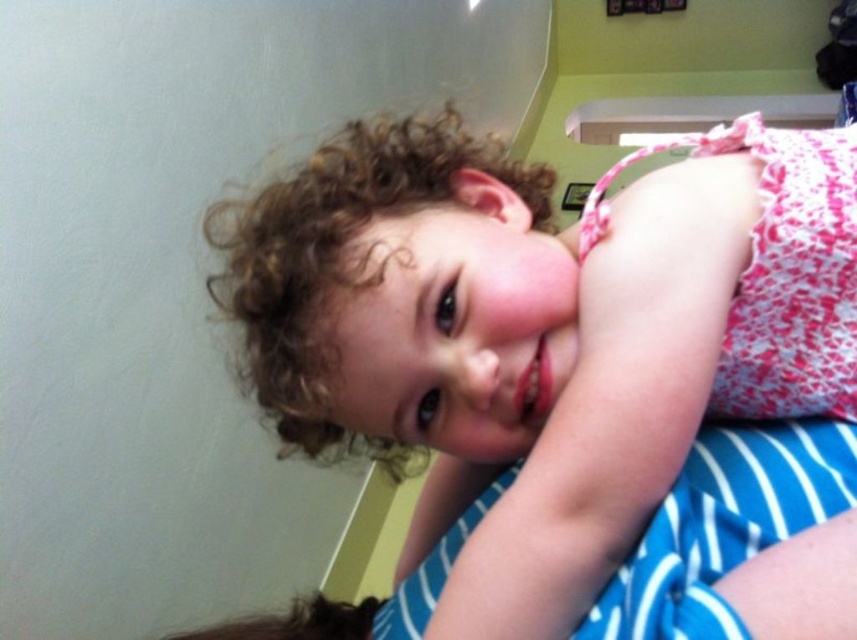
Question: Can you confirm if pink lace dress at center is positioned to the right of blue striped fabric at lower right?

Choices:
 (A) no
 (B) yes

Answer: (A)

Question: Is pink lace dress at center smaller than blue striped fabric at lower right?

Choices:
 (A) yes
 (B) no

Answer: (B)

Question: Observing the image, what is the correct spatial positioning of pink lace dress at center in reference to blue striped fabric at lower right?

Choices:
 (A) above
 (B) below

Answer: (A)

Question: Which point is farther from the camera taking this photo?

Choices:
 (A) (625, 618)
 (B) (669, 627)

Answer: (A)